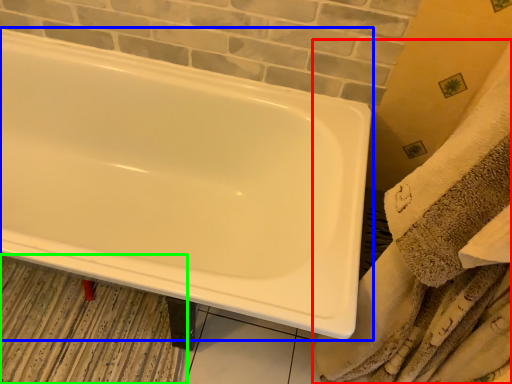
Question: Based on their relative distances, which object is nearer to bath towel (highlighted by a red box)? Choose from bathtub (highlighted by a blue box) and bath mat (highlighted by a green box).

Choices:
 (A) bathtub
 (B) bath mat

Answer: (A)